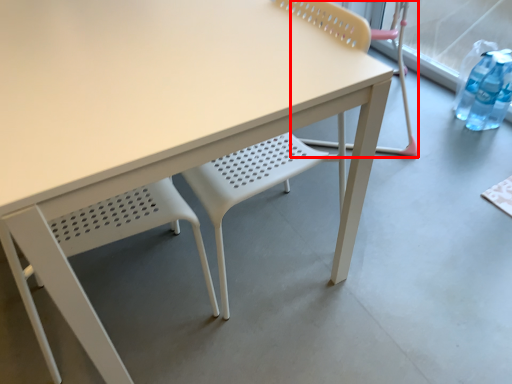
Question: Where is chair (annotated by the red box) located in relation to chair in the image?

Choices:
 (A) right
 (B) left

Answer: (A)